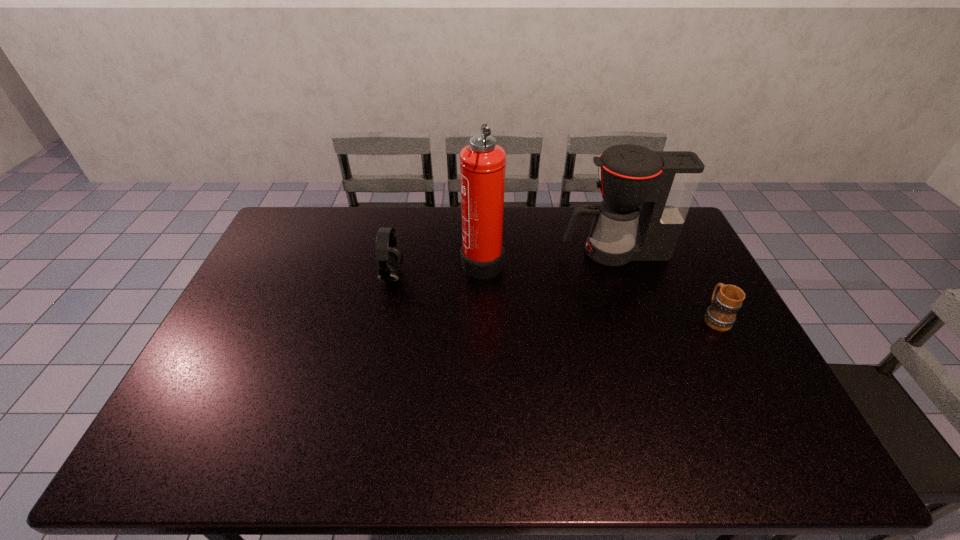
I want to click on fire extinguisher, so click(x=482, y=163).

I want to click on the second object from left to right, so click(x=482, y=163).

Image resolution: width=960 pixels, height=540 pixels. In order to click on coffee maker in this screenshot , I will do `click(664, 183)`.

Locate an element on the screen. Image resolution: width=960 pixels, height=540 pixels. the second tallest object is located at coordinates (664, 183).

The width and height of the screenshot is (960, 540). Identify the location of earphone. (390, 258).

The image size is (960, 540). Identify the location of the third tallest object. (390, 258).

You are a GUI agent. You are given a task and a screenshot of the screen. Output one action in this format:
    pyautogui.click(x=<x>, y=<y>)
    Task: Click on the nearest object
    The image size is (960, 540).
    Given the screenshot: What is the action you would take?
    pyautogui.click(x=721, y=315)

This screenshot has height=540, width=960. Find the location of `mug`. mug is located at coordinates (721, 315).

Where is `vacant position located 0.190m on the front-facing side of the second object from left to right`? The width and height of the screenshot is (960, 540). vacant position located 0.190m on the front-facing side of the second object from left to right is located at coordinates (406, 260).

I want to click on free region located 0.300m on the front-facing side of the second object from left to right, so click(373, 260).